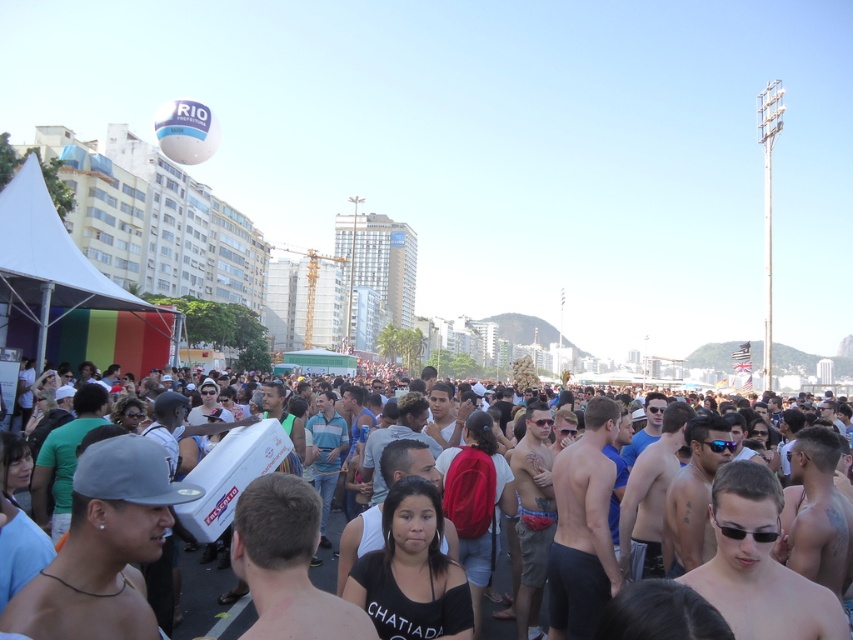
What are the coordinates of `shiny skin at center` in the screenshot? It's located at (759, 564).

Who is taller, shiny skin at center or white matte cooler at center?

With more height is white matte cooler at center.

Describe the element at coordinates (759, 564) in the screenshot. I see `shiny skin at center` at that location.

The image size is (853, 640). In order to click on shiny skin at center in this screenshot , I will do `click(759, 564)`.